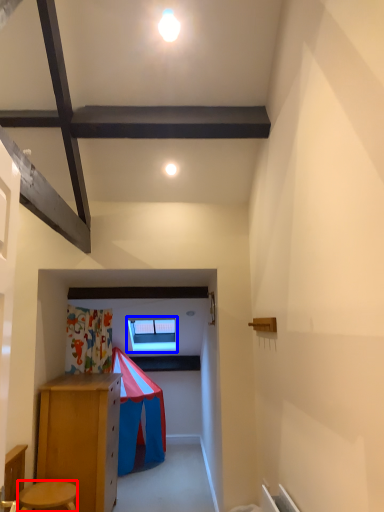
Question: Which of the following is the farthest to the observer, stool (highlighted by a red box) or window (highlighted by a blue box)?

Choices:
 (A) stool
 (B) window

Answer: (B)